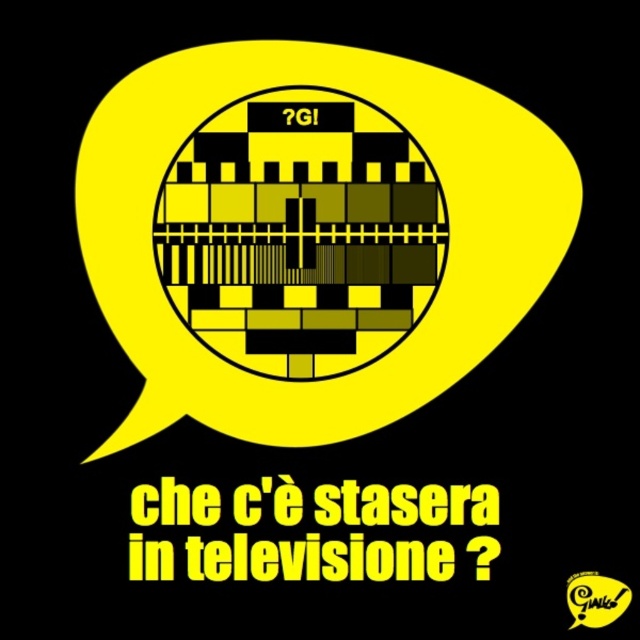
You are trying to scan a QR code located at the center of the image. However, you notice that the QR code is pixelated and difficult to read. Based on the coordinates provided, can you determine if the QR code at point (x=317, y=560) is positioned correctly for scanning?

The point (x=317, y=560) corresponds to the black pixelated QR code at center, so it is positioned correctly for scanning.

You are holding a smartphone camera 5 feet away from the black pixelated qr code at center. Can you scan it successfully?

The black pixelated qr code at center is 5.18 feet away from the viewer. Since your smartphone camera is positioned at 5 feet, which is within the optimal scanning range, you can scan it successfully.